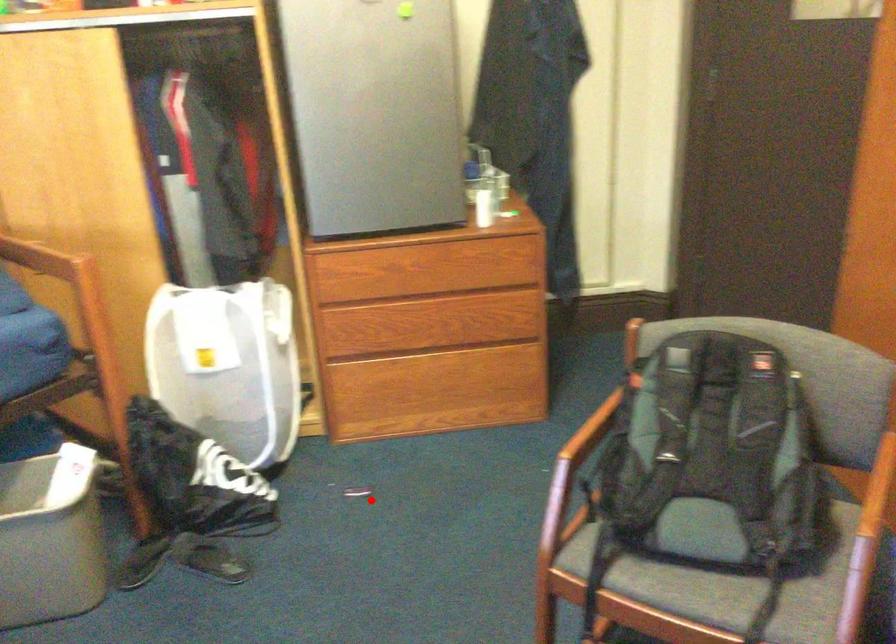
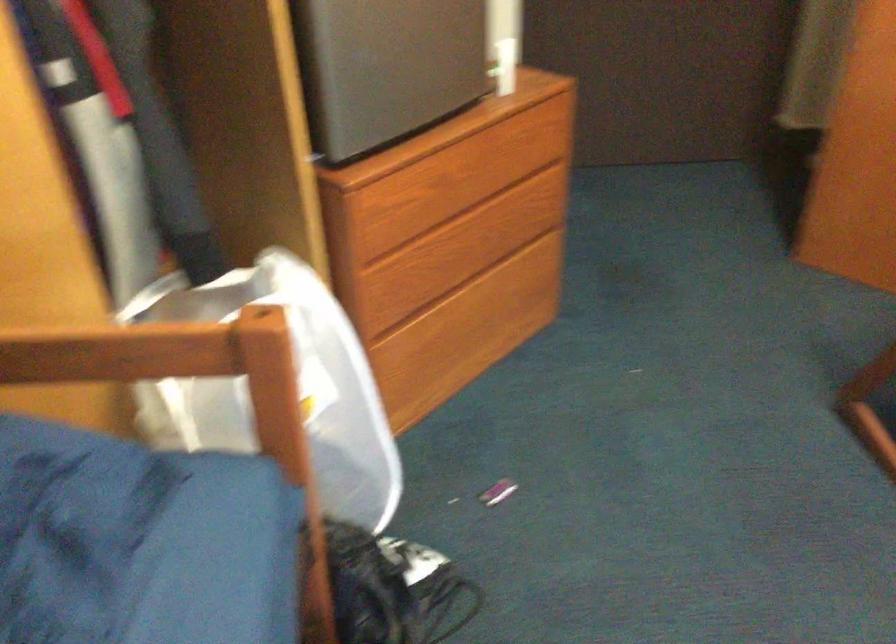
Where in the second image is the point corresponding to the highlighted location from the first image?

(497, 491)